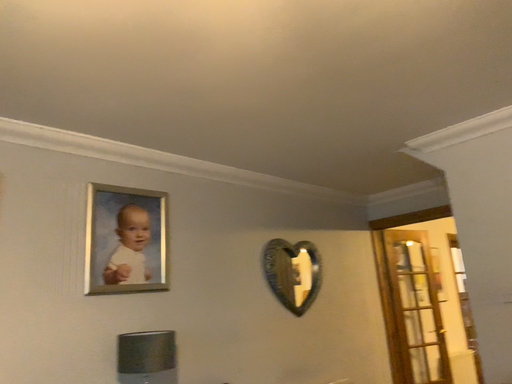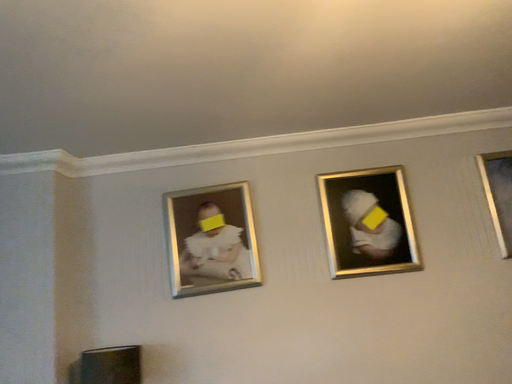
Question: How did the camera likely rotate when shooting the video?

Choices:
 (A) rotated upward
 (B) rotated downward

Answer: (B)